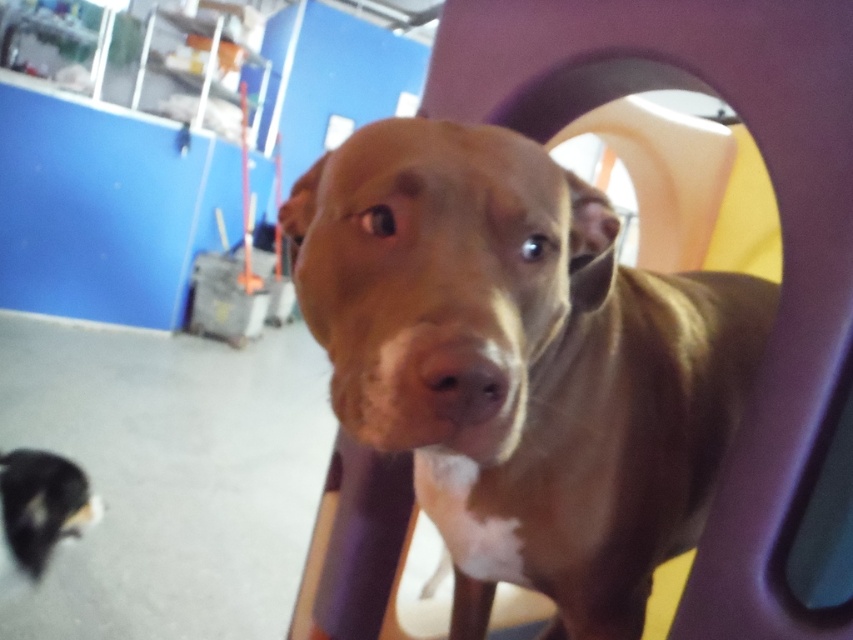
Based on the photo, you are a dog trainer assessing the size of the dogs in the image. Which dog is bigger between the brown shiny dog at center and the black fur dog at lower left?

The brown shiny dog at center is larger in size than the black fur dog at lower left.

You are a photographer trying to capture both the brown shiny dog at center and the black fur dog at lower left in the same frame. Based on their positions, which dog should you adjust your camera angle to focus on first to include both in the shot?

The brown shiny dog at center is positioned on the right side of black fur dog at lower left. To include both in the shot, you should first adjust your camera angle to focus on the black fur dog at lower left since it is on the left side and then pan towards the right to include the brown shiny dog at center in the frame.